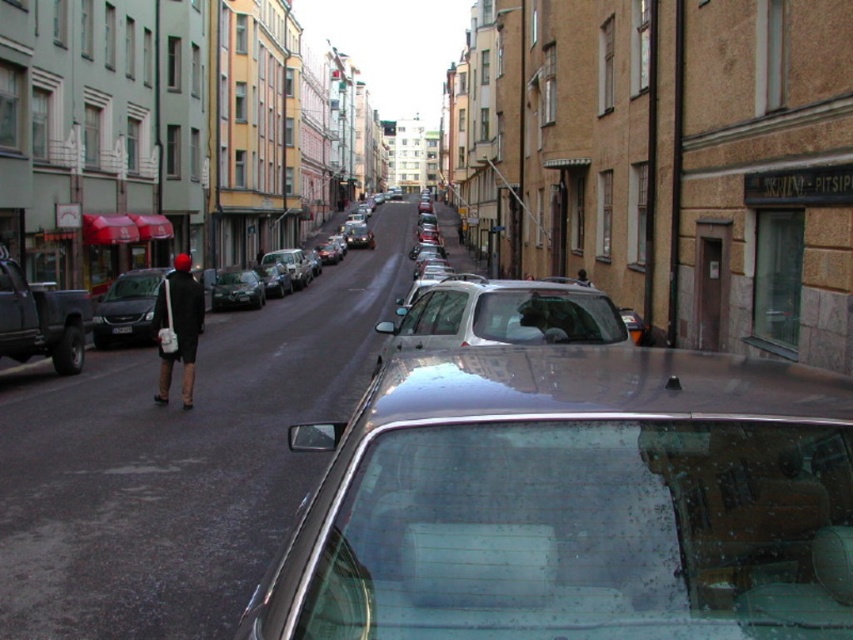
Question: Is shiny metallic car at center bigger than white plastic license plate at center?

Choices:
 (A) yes
 (B) no

Answer: (A)

Question: Which point is farther to the camera?

Choices:
 (A) shiny silver sedan at center
 (B) metallic silver car at center
 (C) white plastic license plate at center

Answer: (A)

Question: Can you confirm if matte black coat at center is positioned to the right of shiny metallic car at center?

Choices:
 (A) no
 (B) yes

Answer: (B)

Question: Which object is closer to the camera taking this photo?

Choices:
 (A) shiny black sedan at center
 (B) matte black coat at center

Answer: (B)

Question: Which object appears closest to the camera in this image?

Choices:
 (A) metallic silver car at center
 (B) matte black coat at center
 (C) shiny silver sedan at center
 (D) shiny black sedan at center

Answer: (A)

Question: Does shiny metallic car at center have a smaller size compared to shiny silver sedan at center?

Choices:
 (A) no
 (B) yes

Answer: (A)